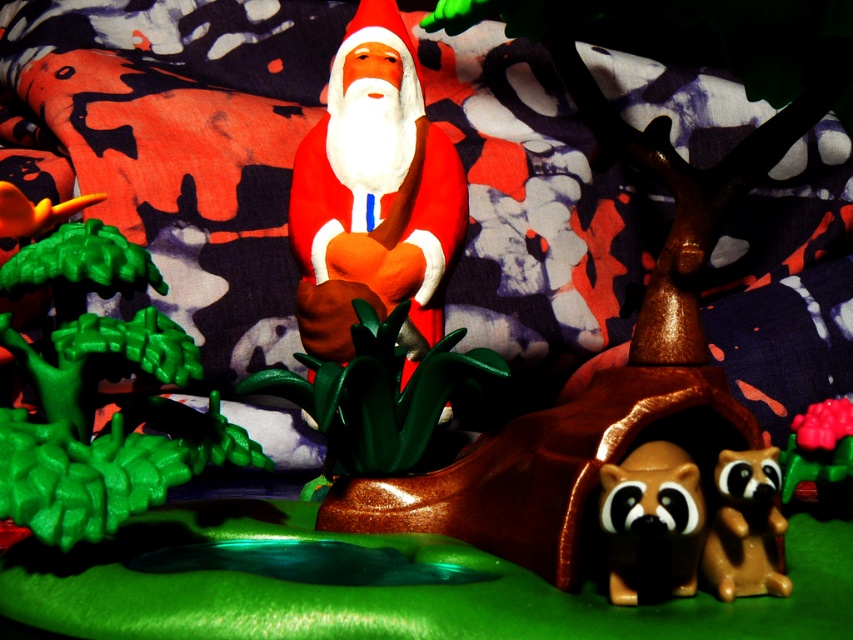
Is matte plastic santa at center thinner than brown glossy raccoon at lower right?

No, matte plastic santa at center is not thinner than brown glossy raccoon at lower right.

Does point (437, 262) lie in front of point (735, 541)?

No, it is not.

Describe the element at coordinates (374, 193) in the screenshot. The image size is (853, 640). I see `matte plastic santa at center` at that location.

You are a GUI agent. You are given a task and a screenshot of the screen. Output one action in this format:
    pyautogui.click(x=<x>, y=<y>)
    Task: Click on the matte plastic santa at center
    Image resolution: width=853 pixels, height=640 pixels.
    Given the screenshot: What is the action you would take?
    coord(374,193)

Does brown glossy raccoon at lower right appear on the right side of rubberized green toy at lower right?

Incorrect, brown glossy raccoon at lower right is not on the right side of rubberized green toy at lower right.

Does brown glossy raccoon at lower right have a greater width compared to rubberized green toy at lower right?

Incorrect, brown glossy raccoon at lower right's width does not surpass rubberized green toy at lower right's.

Which is in front, point (746, 472) or point (840, 428)?

Point (746, 472) is more forward.

The image size is (853, 640). I want to click on brown glossy raccoon at lower right, so click(x=746, y=525).

Is brown matte raccoon at lower right positioned at the back of brown glossy raccoon at lower right?

No, brown matte raccoon at lower right is in front of brown glossy raccoon at lower right.

Can you confirm if brown matte raccoon at lower right is positioned to the right of brown glossy raccoon at lower right?

Incorrect, brown matte raccoon at lower right is not on the right side of brown glossy raccoon at lower right.

Is point (611, 470) more distant than point (770, 593)?

No, (611, 470) is in front of (770, 593).

I want to click on brown matte raccoon at lower right, so click(x=653, y=518).